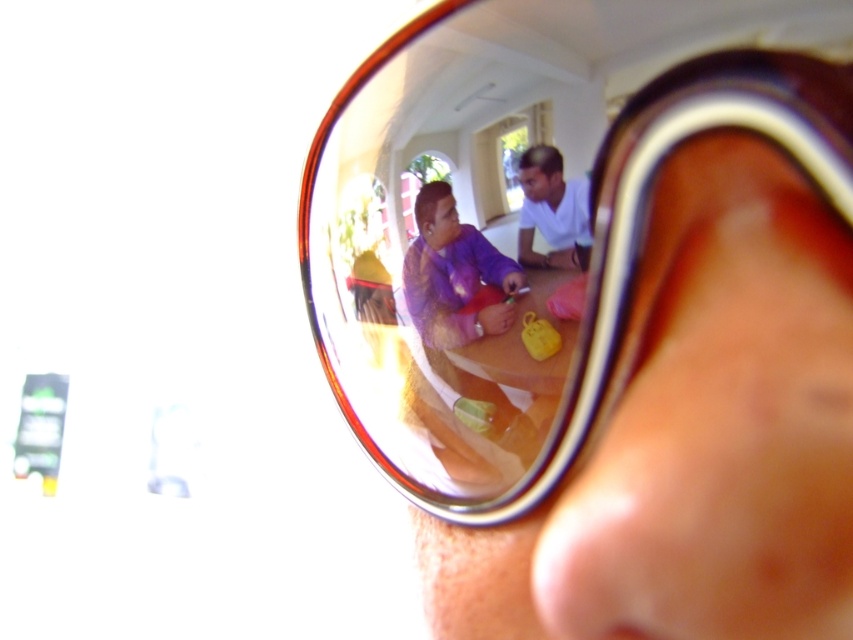
Looking at this image, you are adjusting the focus of your camera to capture the reflection in the sunglasses. You notice two points of interest labeled as point (509, 284) and point (519, 232). Which point should you focus on first if you want to ensure both points are in focus?

You should focus on point (509, 284) first because it is closer to the camera than point (519, 232), ensuring that both points will be in focus when focusing on the closer one.

From the picture: You are trying to determine the relative positions of the shiny brown goggles at center and the purple fabric shirt at center in the reflection. Which object is located to the right of the other?

The shiny brown goggles at center are to the right of the purple fabric shirt at center.

You are trying to determine which object in the reflection is larger based on their apparent size. According to the reflection, which object is bigger between the shiny brown goggles at center and the white matte shirt at center?

The shiny brown goggles at center is bigger than the white matte shirt at center.